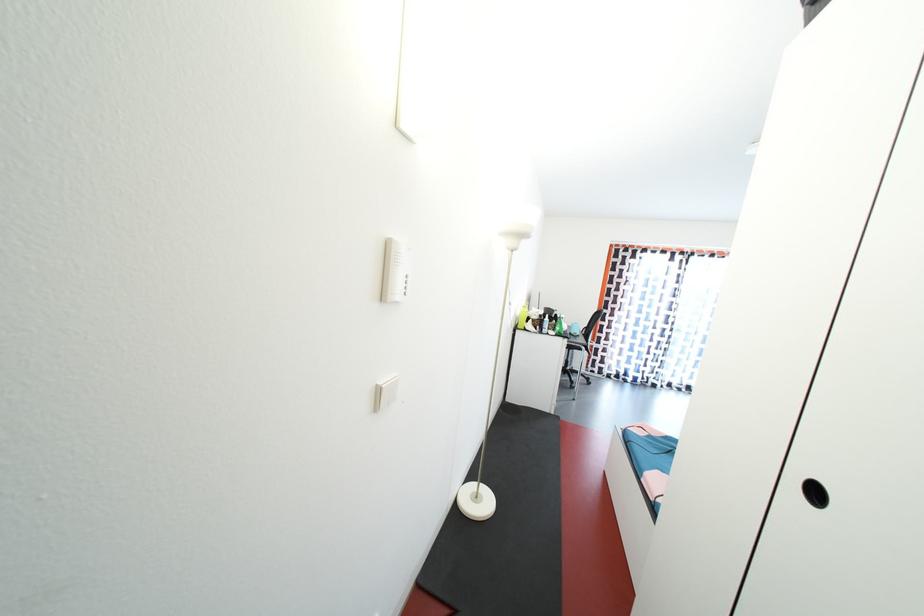
The image size is (924, 616). What do you see at coordinates (554, 326) in the screenshot?
I see `the black bottle` at bounding box center [554, 326].